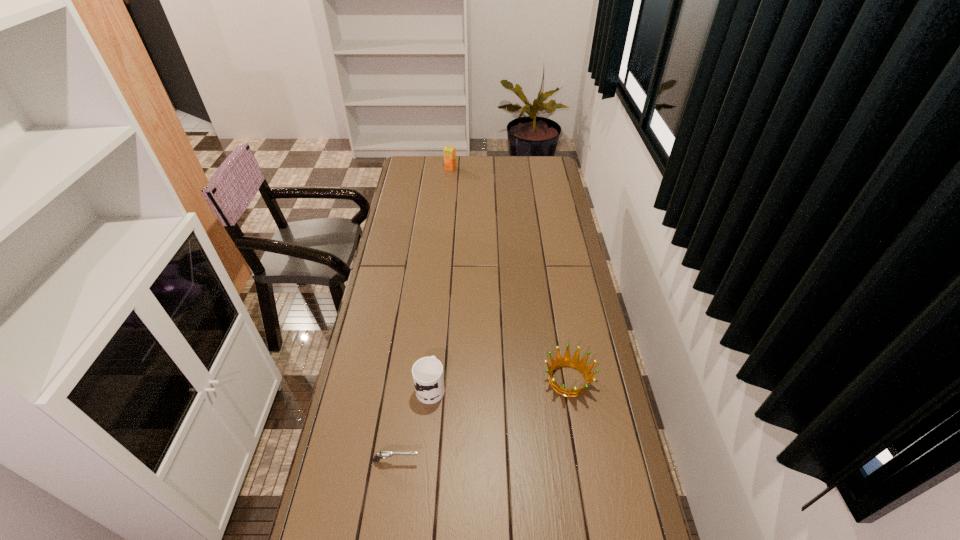
Point out which object is positioned as the second nearest to the rightmost object. Please provide its 2D coordinates. Your answer should be formatted as a tuple, i.e. [(x, y)], where the tuple contains the x and y coordinates of a point satisfying the conditions above.

[(385, 454)]

Locate an element on the screen. The image size is (960, 540). free space that satisfies the following two spatial constraints: 1. on the front side of the farthest object; 2. on the front-facing side of the pistol is located at coordinates (423, 461).

Locate an element on the screen. blank space that satisfies the following two spatial constraints: 1. on the handle side of the crown; 2. on the left side of the mug is located at coordinates (431, 380).

Where is `free point that satisfies the following two spatial constraints: 1. on the handle side of the mug; 2. on the left side of the third tallest object`? free point that satisfies the following two spatial constraints: 1. on the handle side of the mug; 2. on the left side of the third tallest object is located at coordinates (431, 380).

Image resolution: width=960 pixels, height=540 pixels. In order to click on free space that satisfies the following two spatial constraints: 1. on the front side of the crown; 2. on the front-facing side of the pistol in this screenshot , I will do `click(582, 461)`.

I want to click on vacant region that satisfies the following two spatial constraints: 1. on the handle side of the third tallest object; 2. on the right side of the mug, so click(x=431, y=380).

Identify the location of free space that satisfies the following two spatial constraints: 1. on the front side of the orange juice; 2. on the front-facing side of the shortest object. (423, 461).

Identify the location of vacant space that satisfies the following two spatial constraints: 1. on the front side of the farthest object; 2. on the front-facing side of the pistol. (423, 461).